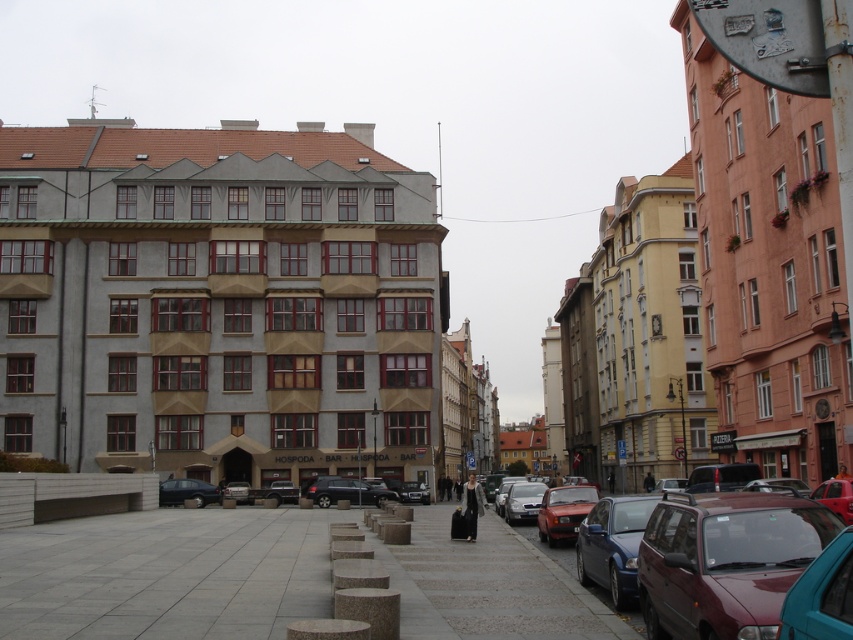
You are a delivery person needing to park your matte black car at lower left near the gray concrete pavement at lower center. Based on the scene, can you safely park the car so that it doesn not block the pavement? Explain your reasoning.

The gray concrete pavement at lower center is to the right of the matte black car at lower left. Since the pavement is already positioned to the right of the car, parking the matte black car at lower left there would not block the pavement as it is already aligned to the left side, keeping the pavement accessible on the right.

In the scene shown: You are a pedestrian standing at the crosswalk. You see a metallic silver suv at center and a matte black car at lower left. Which vehicle is closer to you?

The metallic silver suv at center is positioned under the matte black car at lower left, meaning it is closer to you.